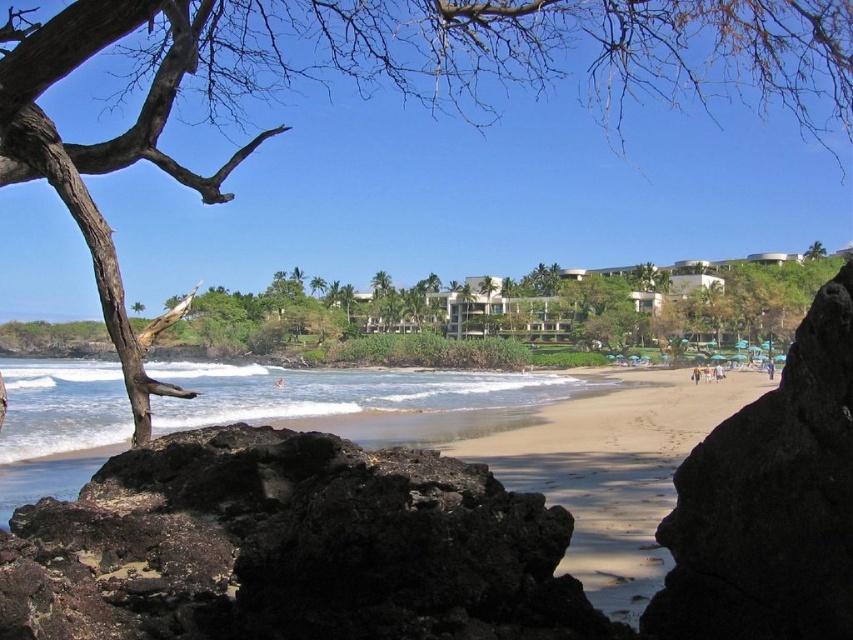
Question: Does dark volcanic rock at lower left appear under white sand at lower center?

Choices:
 (A) yes
 (B) no

Answer: (B)

Question: Can you confirm if black volcanic rock at center is positioned above white sand at lower center?

Choices:
 (A) yes
 (B) no

Answer: (A)

Question: Which of the following is the farthest from the observer?

Choices:
 (A) (122, 436)
 (B) (508, 465)
 (C) (668, 580)
 (D) (778, 0)

Answer: (A)

Question: Does dark volcanic rock at lower left have a lesser width compared to light brown sandy beach at center?

Choices:
 (A) yes
 (B) no

Answer: (A)

Question: Which point is closer to the camera?

Choices:
 (A) brown bark tree at upper left
 (B) dark volcanic rock at lower left
 (C) black volcanic rock at center
 (D) light brown sandy beach at center

Answer: (C)

Question: Among these points, which one is nearest to the camera?

Choices:
 (A) (221, 58)
 (B) (396, 417)

Answer: (A)